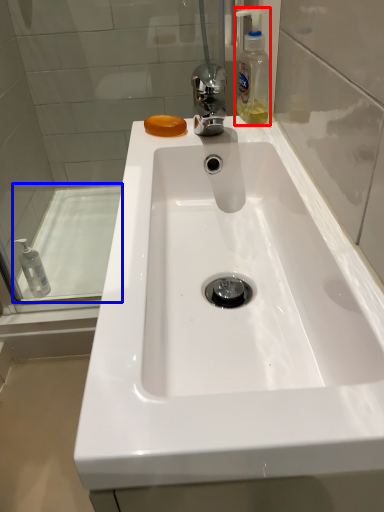
Question: Which of the following is the farthest to the observer, soap dispenser (highlighted by a red box) or bath (highlighted by a blue box)?

Choices:
 (A) soap dispenser
 (B) bath

Answer: (B)